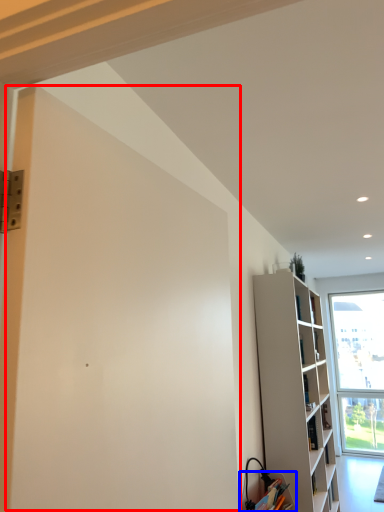
Question: Among these objects, which one is nearest to the camera, screen door (highlighted by a red box) or cabinetry (highlighted by a blue box)?

Choices:
 (A) screen door
 (B) cabinetry

Answer: (A)